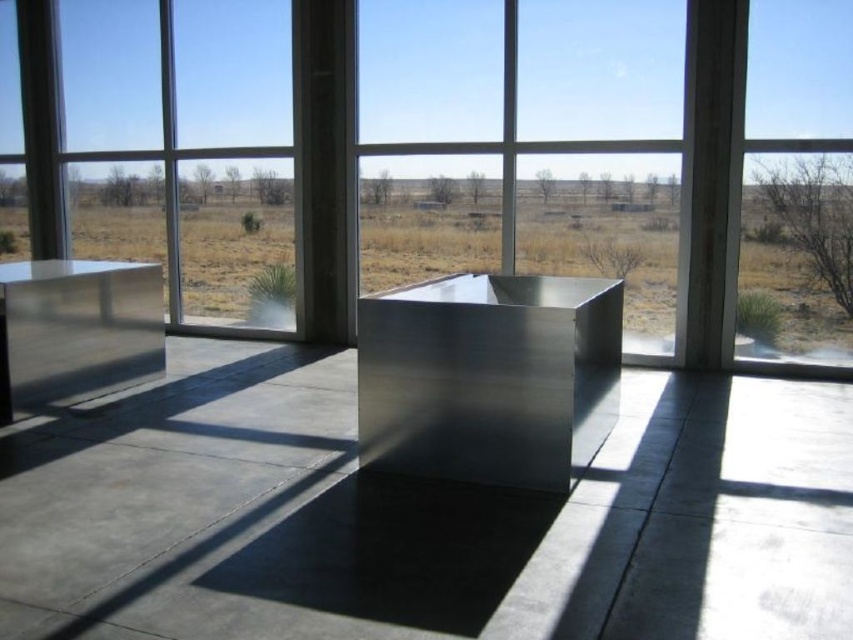
You are standing in the room and want to look outside through the window. Which object at point (525, 145) should you approach to see the arid landscape outside?

The metallic glass at center located at point (525, 145) is the object you should approach to see the arid landscape outside, as it is a window.

You are an interior designer planning to place a new piece of furniture in the room. You see the metallic gray cube at center and the polished metallic box at center. Which one is located to the left when facing the large floor to ceiling windows?

The metallic gray cube at center is positioned on the left side of the polished metallic box at center, so when facing the large floor to ceiling windows, the metallic gray cube at center is located to the left.